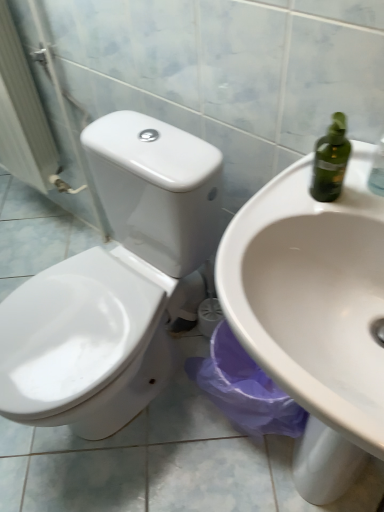
Question: Relative to white glossy sink at center, is white glossy toilet at left in front or behind?

Choices:
 (A) behind
 (B) front

Answer: (A)

Question: Does point (44, 138) appear closer or farther from the camera than point (289, 330)?

Choices:
 (A) closer
 (B) farther

Answer: (B)

Question: Estimate the real-world distances between objects in this image. Which object is closer to the white glossy sink at center?

Choices:
 (A) white glossy toilet at center
 (B) white glossy toilet at left

Answer: (A)

Question: Considering the real-world distances, which object is farthest from the white glossy toilet at left?

Choices:
 (A) white glossy sink at center
 (B) white glossy toilet at center

Answer: (A)